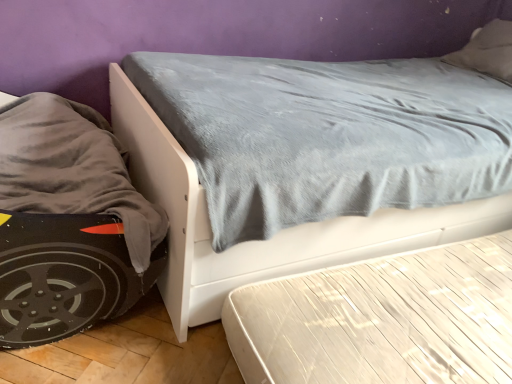
Question: Should I look upward or downward to see white glossy mattress at lower right?

Choices:
 (A) up
 (B) down

Answer: (B)

Question: Does white glossy mattress at lower right come behind velvet gray bed at center?

Choices:
 (A) no
 (B) yes

Answer: (B)

Question: From a real-world perspective, is white glossy mattress at lower right over velvet gray bed at center?

Choices:
 (A) yes
 (B) no

Answer: (B)

Question: From a real-world perspective, is white glossy mattress at lower right located beneath velvet gray bed at center?

Choices:
 (A) yes
 (B) no

Answer: (A)

Question: Is white glossy mattress at lower right positioned with its back to velvet gray bed at center?

Choices:
 (A) yes
 (B) no

Answer: (B)

Question: Can you confirm if white glossy mattress at lower right is smaller than velvet gray bed at center?

Choices:
 (A) yes
 (B) no

Answer: (A)

Question: Is white glossy mattress at lower right with velvet gray bed at center?

Choices:
 (A) no
 (B) yes

Answer: (A)

Question: Considering the relative positions of velvet gray bed at center and white glossy mattress at lower right in the image provided, is velvet gray bed at center to the left of white glossy mattress at lower right from the viewer's perspective?

Choices:
 (A) yes
 (B) no

Answer: (A)

Question: Is velvet gray bed at center thinner than white glossy mattress at lower right?

Choices:
 (A) no
 (B) yes

Answer: (B)

Question: Can you confirm if velvet gray bed at center is bigger than white glossy mattress at lower right?

Choices:
 (A) yes
 (B) no

Answer: (A)

Question: Is velvet gray bed at center further to the viewer compared to white glossy mattress at lower right?

Choices:
 (A) yes
 (B) no

Answer: (B)

Question: Is velvet gray bed at center looking in the opposite direction of white glossy mattress at lower right?

Choices:
 (A) yes
 (B) no

Answer: (B)

Question: Is velvet gray bed at center not inside white glossy mattress at lower right?

Choices:
 (A) no
 (B) yes

Answer: (B)

Question: Choose the correct answer: Is white glossy mattress at lower right inside velvet gray bed at center or outside it?

Choices:
 (A) inside
 (B) outside

Answer: (B)